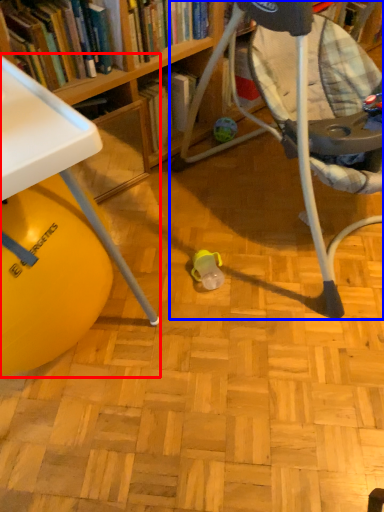
Question: Among these objects, which one is farthest to the camera, table (highlighted by a red box) or chair (highlighted by a blue box)?

Choices:
 (A) table
 (B) chair

Answer: (A)